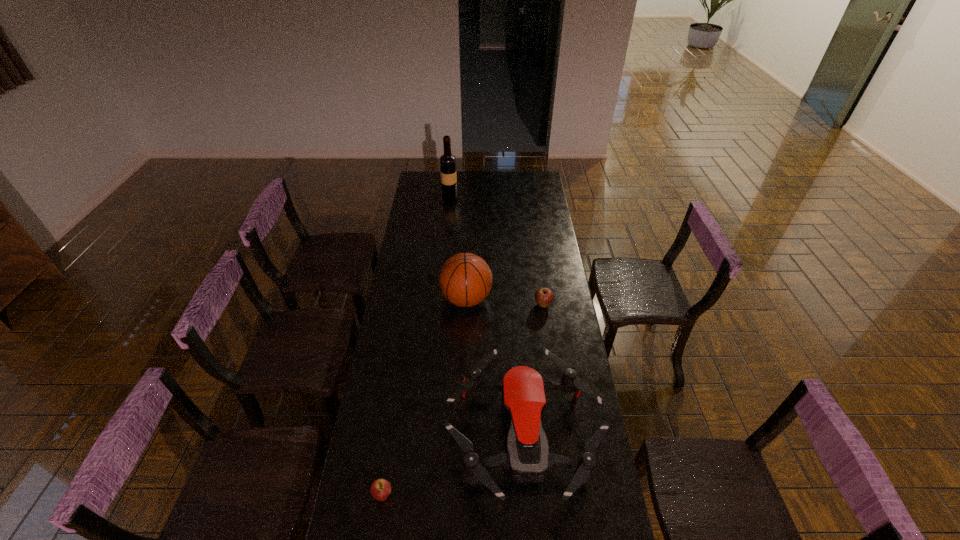
What are the coordinates of `free space located on the back of the left apple` in the screenshot? It's located at (389, 458).

At what (x,y) coordinates should I click in order to perform the action: click on object that is positioned at the left edge. Please return your answer as a coordinate pair (x, y). Looking at the image, I should click on (380, 489).

Image resolution: width=960 pixels, height=540 pixels. Find the location of `drone that is at the right edge`. drone that is at the right edge is located at coordinates (527, 458).

Image resolution: width=960 pixels, height=540 pixels. In order to click on apple that is at the right edge in this screenshot , I will do `click(544, 296)`.

The image size is (960, 540). I want to click on vacant space at the far edge of the desktop, so click(457, 185).

In order to click on free region at the left edge in this screenshot , I will do `click(409, 413)`.

This screenshot has height=540, width=960. Find the location of `free space at the right edge`. free space at the right edge is located at coordinates (551, 213).

Locate an element on the screen. Image resolution: width=960 pixels, height=540 pixels. free point at the far right corner is located at coordinates (523, 186).

Image resolution: width=960 pixels, height=540 pixels. What are the coordinates of `vacant area that lies between the wine bottle and the basketball` in the screenshot? It's located at (458, 247).

Identify the location of free spot between the third shortest object and the nearer apple. The width and height of the screenshot is (960, 540). (x=453, y=466).